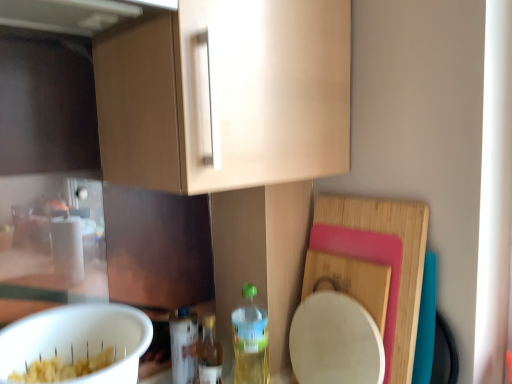
Question: Considering their positions, is translucent plastic bottle at lower center, arranged as the 1th bottle when viewed from the left, located in front of or behind translucent plastic bottle at lower center, the third bottle when ordered from left to right?

Choices:
 (A) behind
 (B) front

Answer: (A)

Question: In terms of width, does translucent plastic bottle at lower center, arranged as the 1th bottle when viewed from the left, look wider or thinner when compared to translucent plastic bottle at lower center, the third bottle when ordered from left to right?

Choices:
 (A) wide
 (B) thin

Answer: (B)

Question: Which is nearer to the translucent plastic bottle at lower center, the third bottle when ordered from left to right?

Choices:
 (A) translucent plastic bottle at lower center, the third bottle in the right-to-left sequence
 (B) white matte mixing bowl at lower left
 (C) translucent plastic bottle at lower center, marked as the second bottle in a left-to-right arrangement

Answer: (C)

Question: Estimate the real-world distances between objects in this image. Which object is closer to the translucent plastic bottle at lower center, marked as the second bottle in a left-to-right arrangement?

Choices:
 (A) translucent plastic bottle at lower center, the third bottle when ordered from left to right
 (B) translucent plastic bottle at lower center, arranged as the 1th bottle when viewed from the left
 (C) white matte mixing bowl at lower left

Answer: (B)